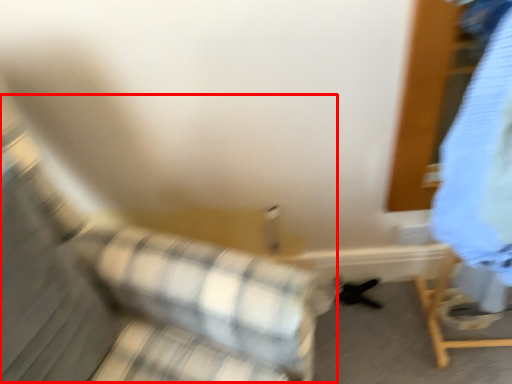
Question: From the image, what is the correct spatial relationship of couch (annotated by the red box) in relation to clothing?

Choices:
 (A) right
 (B) left

Answer: (B)